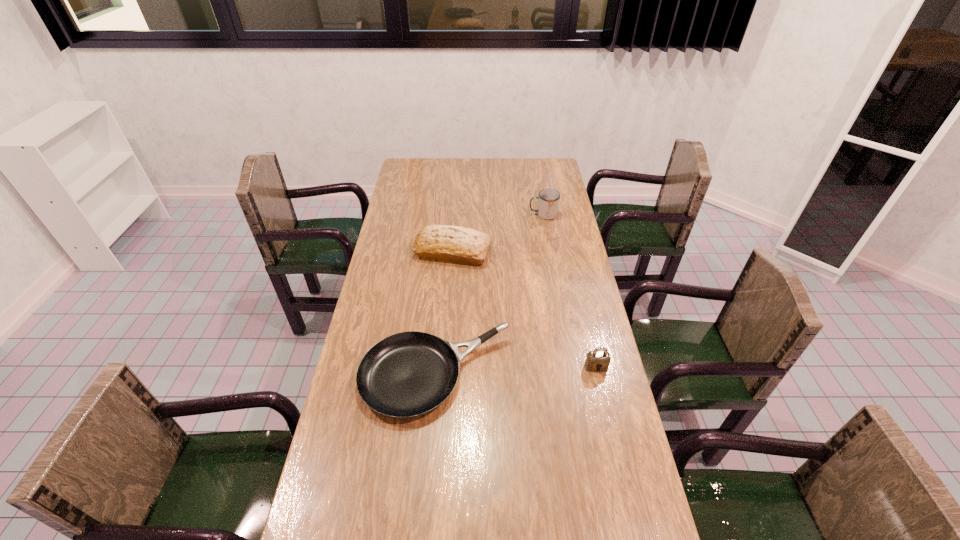
Locate an element on the screen. bread present at the left edge is located at coordinates (453, 244).

You are a GUI agent. You are given a task and a screenshot of the screen. Output one action in this format:
    pyautogui.click(x=<x>, y=<y>)
    Task: Click on the pan at the left edge
    The width and height of the screenshot is (960, 540).
    Given the screenshot: What is the action you would take?
    pyautogui.click(x=407, y=374)

Identify the location of mug positioned at the right edge. This screenshot has height=540, width=960. (548, 203).

Identify the location of padlock located at the right edge. This screenshot has width=960, height=540. (598, 360).

At what (x,y) coordinates should I click in order to perform the action: click on vacant area at the far edge. Please return your answer as a coordinate pair (x, y). This screenshot has width=960, height=540. Looking at the image, I should click on (461, 167).

The height and width of the screenshot is (540, 960). In the image, there is a desktop. In order to click on free space at the left edge in this screenshot , I will do `click(383, 293)`.

Locate an element on the screen. The height and width of the screenshot is (540, 960). vacant region at the right edge of the desktop is located at coordinates (560, 391).

The height and width of the screenshot is (540, 960). I want to click on blank space at the far left corner of the desktop, so click(408, 172).

In the image, there is a desktop. Where is `free space at the far right corner`? free space at the far right corner is located at coordinates (558, 161).

You are a GUI agent. You are given a task and a screenshot of the screen. Output one action in this format:
    pyautogui.click(x=<x>, y=<y>)
    Task: Click on the vacant region between the second farthest object and the padlock
    The height and width of the screenshot is (540, 960).
    Given the screenshot: What is the action you would take?
    (x=524, y=309)